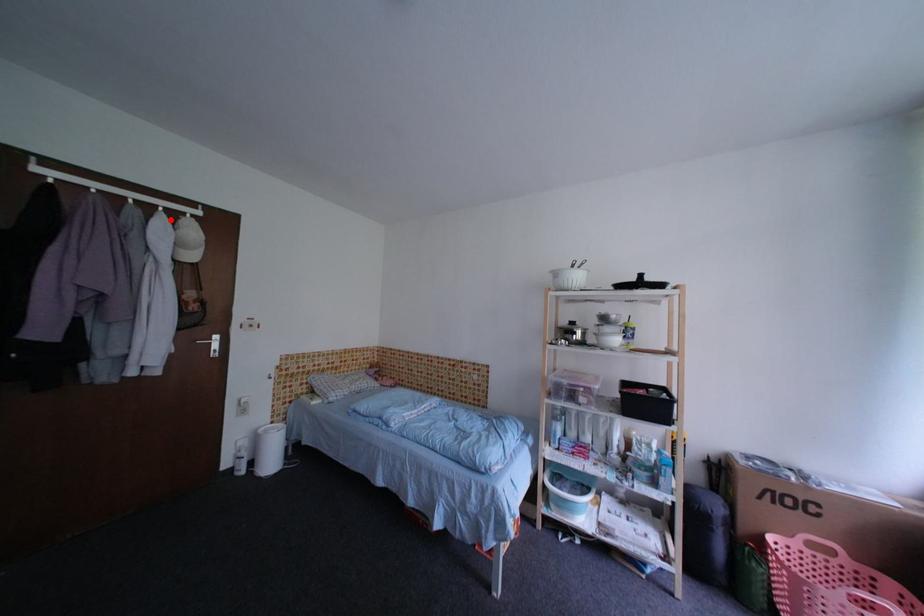
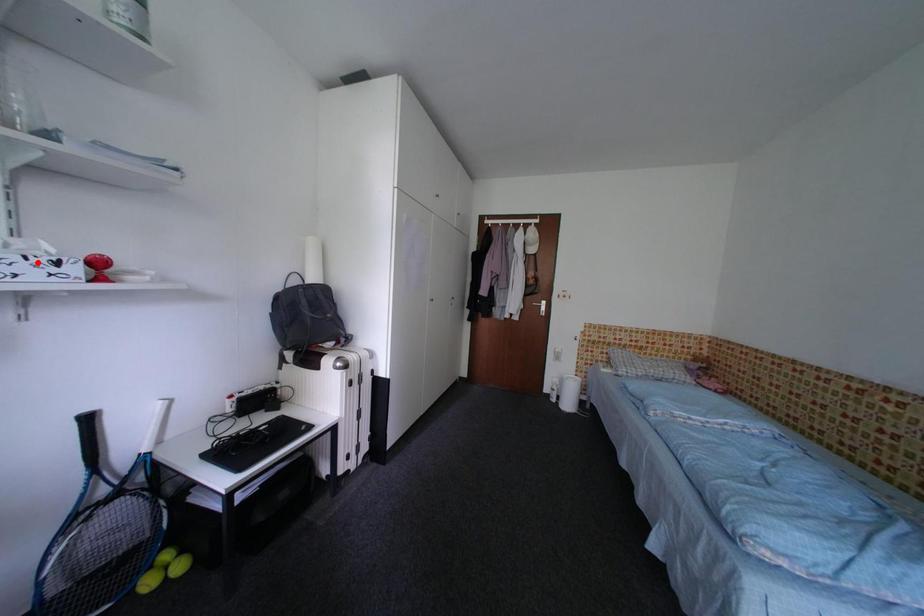
I am providing you with two images of the same scene from different viewpoints. A red point is marked on the first image and another point is marked on the second image. Is the marked point in image1 the same physical position as the marked point in image2?

No